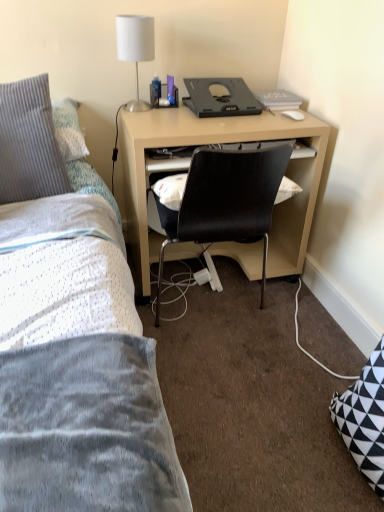
This screenshot has height=512, width=384. Find the location of `unoccupied region to the right of white fabric lampshade at upper center`. unoccupied region to the right of white fabric lampshade at upper center is located at coordinates (173, 113).